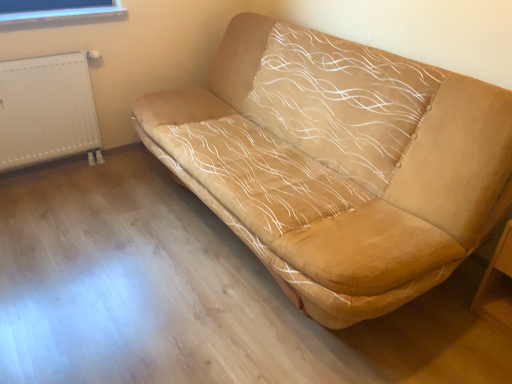
This screenshot has width=512, height=384. I want to click on free space on the front side of white plastic radiator at left, so click(x=52, y=201).